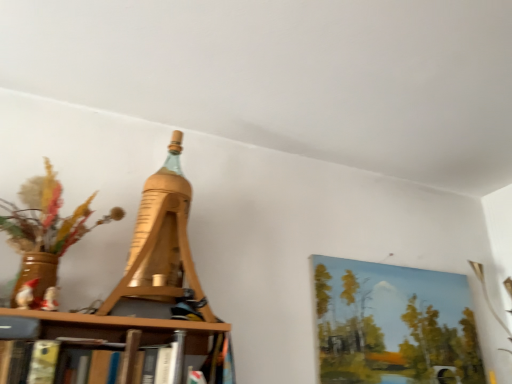
The height and width of the screenshot is (384, 512). Describe the element at coordinates (162, 242) in the screenshot. I see `wooden eiffel tower at center` at that location.

What are the coordinates of `wooden eiffel tower at center` in the screenshot? It's located at (162, 242).

The width and height of the screenshot is (512, 384). What do you see at coordinates (394, 325) in the screenshot?
I see `painted canvas at upper right` at bounding box center [394, 325].

Identify the location of painted canvas at upper right. This screenshot has height=384, width=512. pos(394,325).

The width and height of the screenshot is (512, 384). Identify the location of wooden eiffel tower at center. point(162,242).

Which is more to the right, wooden eiffel tower at center or painted canvas at upper right?

Positioned to the right is painted canvas at upper right.

Which object is more forward, wooden eiffel tower at center or painted canvas at upper right?

wooden eiffel tower at center.

Does point (187, 220) appear closer or farther from the camera than point (452, 341)?

Point (187, 220) is positioned closer to the camera compared to point (452, 341).

In the scene shown: From the image's perspective, is wooden eiffel tower at center under painted canvas at upper right?

Incorrect, from the image's perspective, wooden eiffel tower at center is higher than painted canvas at upper right.

From a real-world perspective, is wooden eiffel tower at center located higher than painted canvas at upper right?

Yes.

Is wooden eiffel tower at center thinner than painted canvas at upper right?

No.

Consider the image. From their relative heights in the image, would you say wooden eiffel tower at center is taller or shorter than painted canvas at upper right?

wooden eiffel tower at center is taller than painted canvas at upper right.

Which of these two, wooden eiffel tower at center or painted canvas at upper right, is smaller?

Smaller between the two is painted canvas at upper right.

Can we say wooden eiffel tower at center lies outside painted canvas at upper right?

Absolutely, wooden eiffel tower at center is external to painted canvas at upper right.

Is wooden eiffel tower at center next to painted canvas at upper right and touching it?

wooden eiffel tower at center and painted canvas at upper right are not in contact.

Does wooden eiffel tower at center turn towards painted canvas at upper right?

No, wooden eiffel tower at center is not aimed at painted canvas at upper right.

How far apart are wooden eiffel tower at center and painted canvas at upper right?

They are 25.39 inches apart.

Locate an element on the screen. Image resolution: width=512 pixels, height=384 pixels. Eiffel tower to the left of painted canvas at upper right is located at coordinates (162, 242).

Between painted canvas at upper right and wooden eiffel tower at center, which one appears on the right side from the viewer's perspective?

Positioned to the right is painted canvas at upper right.

Does painted canvas at upper right lie behind wooden eiffel tower at center?

Yes, painted canvas at upper right is behind wooden eiffel tower at center.

Is point (349, 285) positioned in front of point (189, 261)?

No, (349, 285) is behind (189, 261).

From the image's perspective, is painted canvas at upper right below wooden eiffel tower at center?

Indeed, from the image's perspective, painted canvas at upper right is shown beneath wooden eiffel tower at center.

From a real-world perspective, is painted canvas at upper right positioned under wooden eiffel tower at center based on gravity?

Yes.

Considering the sizes of objects painted canvas at upper right and wooden eiffel tower at center in the image provided, who is thinner, painted canvas at upper right or wooden eiffel tower at center?

Thinner between the two is painted canvas at upper right.

Considering the sizes of painted canvas at upper right and wooden eiffel tower at center in the image, is painted canvas at upper right taller or shorter than wooden eiffel tower at center?

Clearly, painted canvas at upper right is shorter compared to wooden eiffel tower at center.

Is painted canvas at upper right smaller than wooden eiffel tower at center?

Yes.

Is wooden eiffel tower at center surrounded by painted canvas at upper right?

No, wooden eiffel tower at center is not a part of painted canvas at upper right.

Is painted canvas at upper right not close to wooden eiffel tower at center?

No, painted canvas at upper right is not far from wooden eiffel tower at center.

Is painted canvas at upper right oriented away from wooden eiffel tower at center?

No, painted canvas at upper right is not facing the opposite direction of wooden eiffel tower at center.

How many degrees apart are the facing directions of painted canvas at upper right and wooden eiffel tower at center?

The facing directions of painted canvas at upper right and wooden eiffel tower at center are 0.275 degrees apart.

Find the location of a particular element. Eiffel tower in front of the painted canvas at upper right is located at coordinates (162, 242).

Image resolution: width=512 pixels, height=384 pixels. Identify the location of picture frame lying behind the wooden eiffel tower at center. (394, 325).

Find the location of a particular element. The image size is (512, 384). picture frame below the wooden eiffel tower at center (from a real-world perspective) is located at coordinates (394, 325).